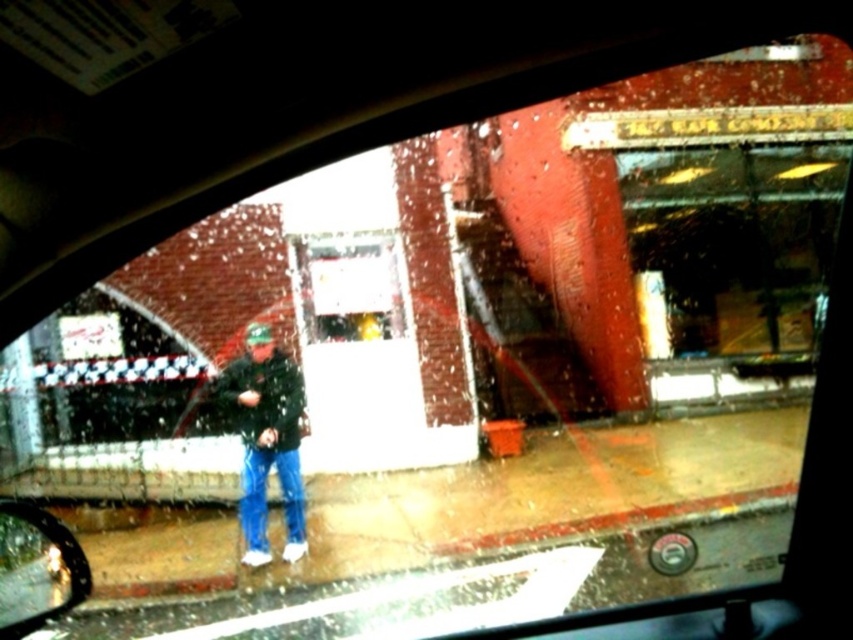
You are inside a car and looking out through the windshield. You see a person wearing a dark green textured jacket at center. Where is the point at coordinate (265, 438) located?

The point at coordinate (265, 438) is located on the dark green textured jacket at center.

You are driving and notice two items in your vehicle. There is a dark green textured jacket at center and a shiny black mirror at lower left. Which item is closer to the windshield?

The dark green textured jacket at center is positioned under the shiny black mirror at lower left, meaning it is closer to the windshield than the mirror.

You are driving and notice the dark green textured jacket at center and the shiny black mirror at lower left in your view. Which object is closer to you, the driver?

The dark green textured jacket at center is closer to you than the shiny black mirror at lower left because the mirror is positioned behind the jacket.